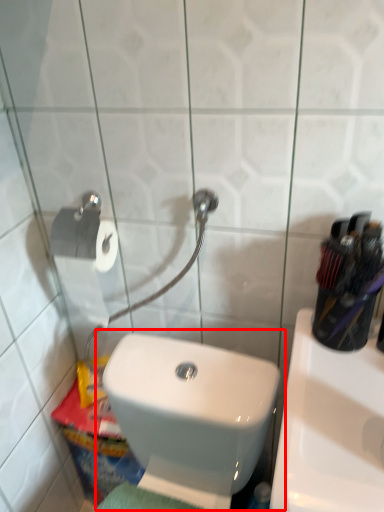
Question: From the image, what is the correct spatial relationship of toilet (annotated by the red box) in relation to sink?

Choices:
 (A) right
 (B) left

Answer: (B)